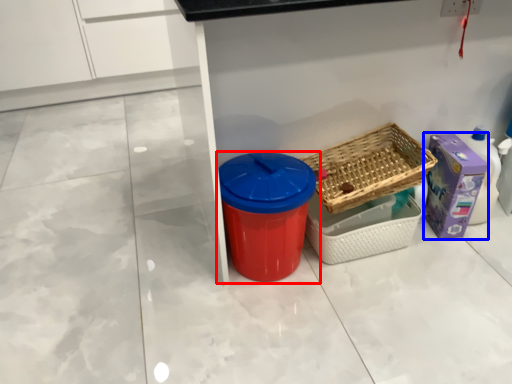
Question: Which object is closer to the camera taking this photo, waste container (highlighted by a red box) or storage box (highlighted by a blue box)?

Choices:
 (A) waste container
 (B) storage box

Answer: (A)